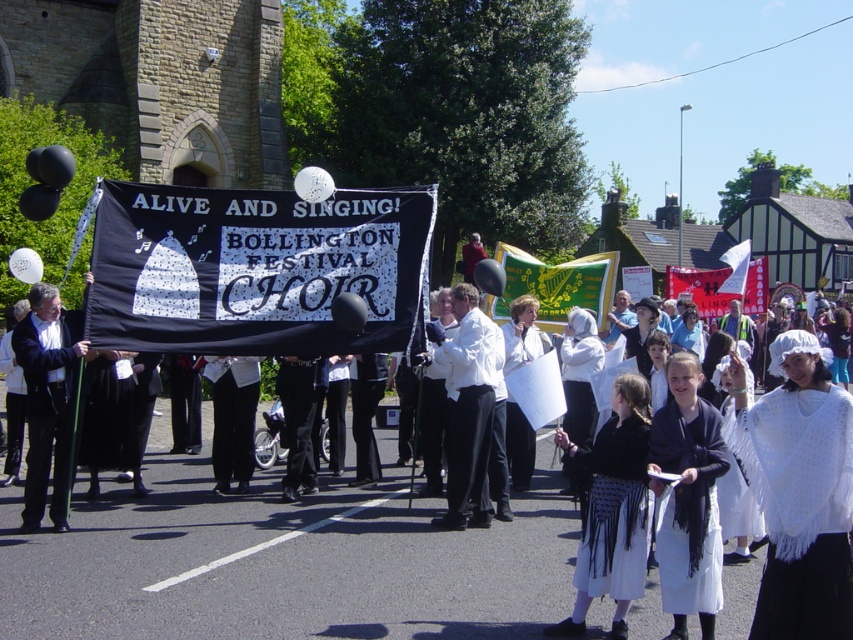
From the picture: Which of these two, white satin shirt at center or white fabric at center, stands shorter?

white fabric at center

Is the position of white satin shirt at center less distant than that of white fabric at center?

Yes, white satin shirt at center is in front of white fabric at center.

The image size is (853, 640). What are the coordinates of `white satin shirt at center` in the screenshot? It's located at (468, 404).

Where is `white satin shirt at center`? white satin shirt at center is located at coordinates (468, 404).

Does black matte suit at center appear over black smooth pants at center?

Correct, black matte suit at center is located above black smooth pants at center.

Which of these two, black matte suit at center or black smooth pants at center, stands shorter?

black smooth pants at center

Who is more distant from viewer, [39,380] or [300,392]?

The point [300,392] is behind.

At what (x,y) coordinates should I click in order to perform the action: click on black matte suit at center. Please return your answer as a coordinate pair (x, y). Looking at the image, I should click on (48, 401).

Is point (624, 589) more distant than point (517, 324)?

No, (624, 589) is in front of (517, 324).

Describe the element at coordinates (611, 508) in the screenshot. I see `black fringed skirt at lower center` at that location.

Does point (630, 492) come farther from viewer compared to point (524, 458)?

No.

Locate an element on the screen. black fringed skirt at lower center is located at coordinates (611, 508).